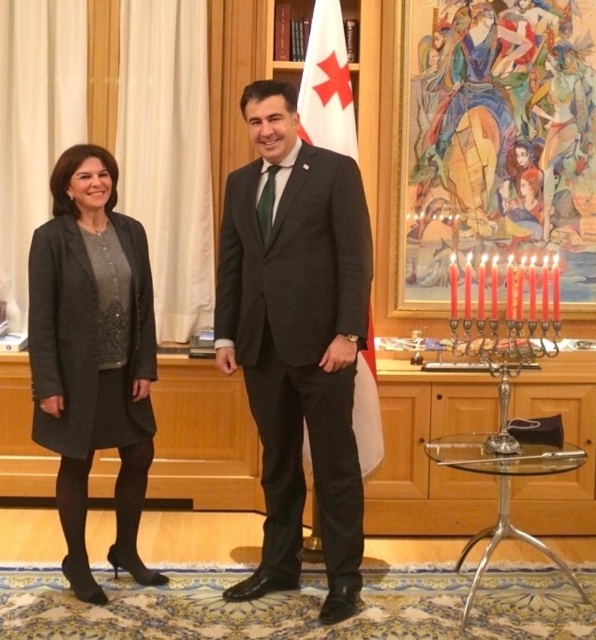
Question: Which point is farther to the camera?

Choices:
 (A) white fabric flag at center
 (B) matte gray coat at left

Answer: (A)

Question: Does matte gray coat at left appear under white fabric flag at center?

Choices:
 (A) yes
 (B) no

Answer: (A)

Question: Is black wool suit at center to the left of matte black coat at left from the viewer's perspective?

Choices:
 (A) yes
 (B) no

Answer: (B)

Question: Which of the following is the farthest from the observer?

Choices:
 (A) [333, 392]
 (B) [54, 346]
 (C) [64, 301]
 (D) [136, 579]

Answer: (D)

Question: Does matte black coat at left appear on the left side of matte gray coat at left?

Choices:
 (A) yes
 (B) no

Answer: (B)

Question: Which object is closer to the camera taking this photo?

Choices:
 (A) matte gray coat at left
 (B) white fabric flag at center
 (C) matte black coat at left
 (D) dark gray wool coat at center

Answer: (D)